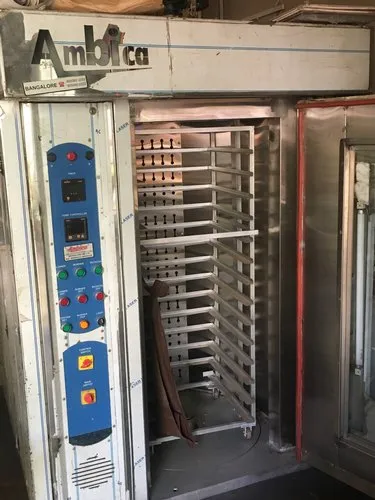
Identify the location of blue panels. (93, 202), (102, 372).